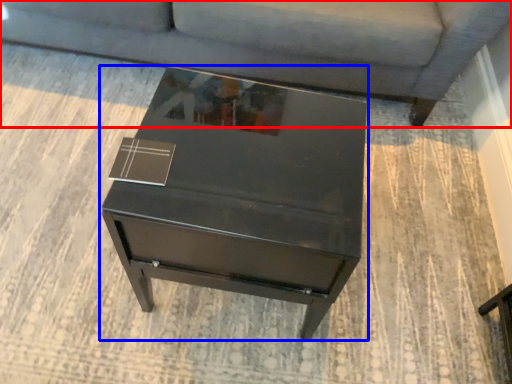
Question: Which of the following is the closest to the observer, studio couch (highlighted by a red box) or table (highlighted by a blue box)?

Choices:
 (A) studio couch
 (B) table

Answer: (B)